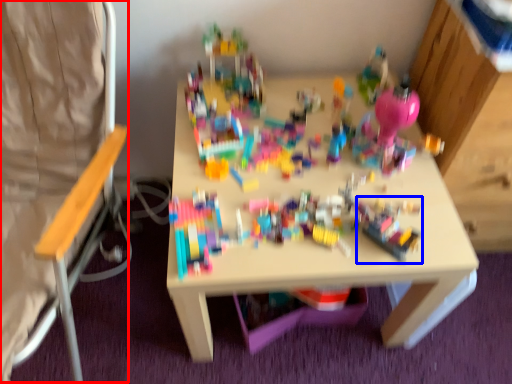
Question: Which object appears farthest to the camera in this image, folding chair (highlighted by a red box) or toy (highlighted by a blue box)?

Choices:
 (A) folding chair
 (B) toy

Answer: (B)